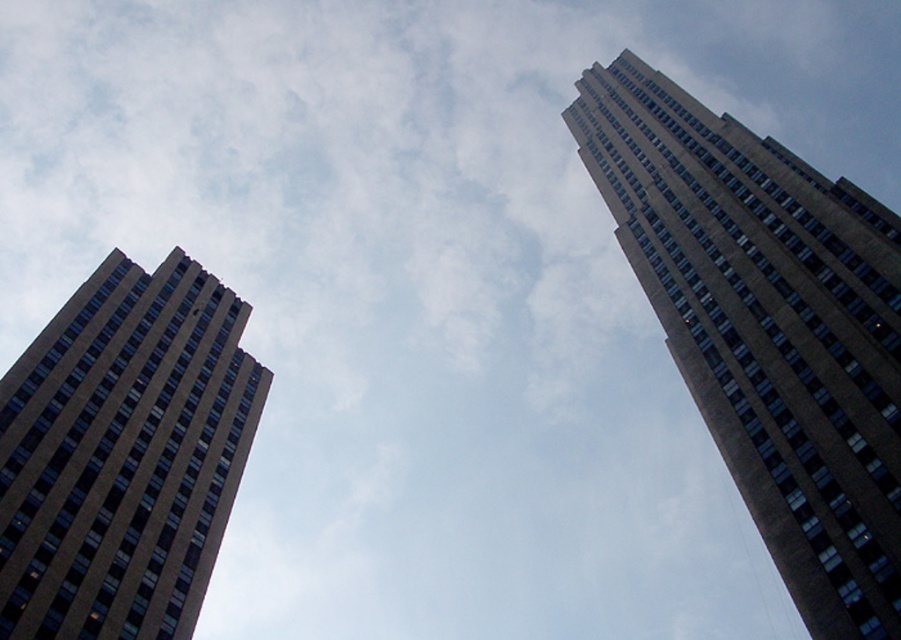
You are standing at the origin point of the coordinate system. You want to locate the brown concrete building at right. In which direction should you look?

You should look towards the point at coordinates 0.520 on the x axis and 0.850 on the y axis to locate the brown concrete building at right.

You are standing on the ground floor of a nearby building and looking up at the two brown concrete buildings. Which one appears closer to you, the brown concrete building at right or the brown concrete building at left?

The brown concrete building at right appears closer because it is positioned over the brown concrete building at left, indicating it is nearer in the visual perspective.